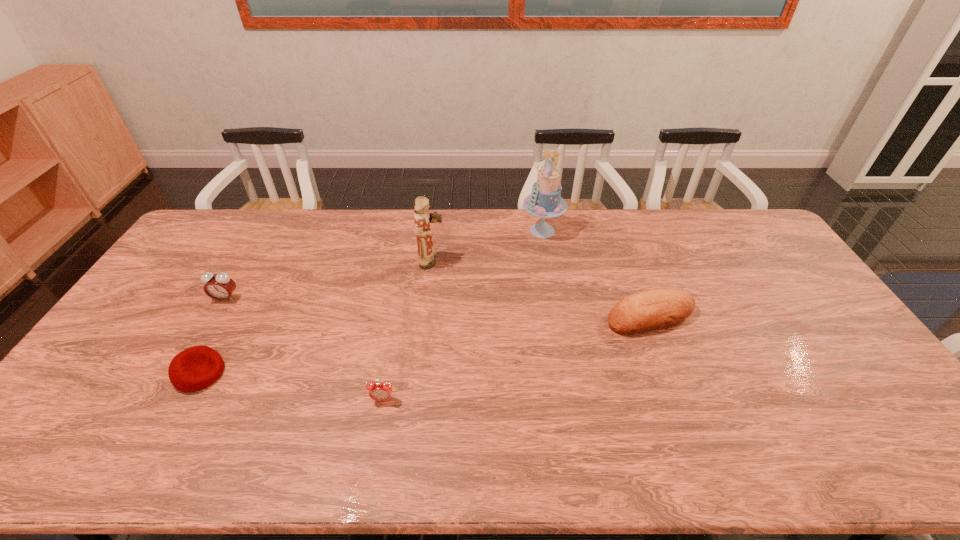
I want to click on the fifth object from left to right, so click(545, 201).

Locate an element on the screen. the farthest object is located at coordinates (545, 201).

Where is `the second tallest object`? This screenshot has height=540, width=960. the second tallest object is located at coordinates (427, 259).

Locate an element on the screen. figurine is located at coordinates (427, 259).

Locate an element on the screen. Image resolution: width=960 pixels, height=540 pixels. the taller alarm clock is located at coordinates (220, 286).

This screenshot has width=960, height=540. What are the coordinates of `the third tallest object` in the screenshot? It's located at (220, 286).

Image resolution: width=960 pixels, height=540 pixels. Find the location of `the nearest object`. the nearest object is located at coordinates (379, 391).

Locate an element on the screen. This screenshot has height=540, width=960. the right alarm clock is located at coordinates (379, 391).

Locate an element on the screen. The image size is (960, 540). the rightmost object is located at coordinates (656, 309).

Locate an element on the screen. The height and width of the screenshot is (540, 960). the fifth farthest object is located at coordinates (195, 368).